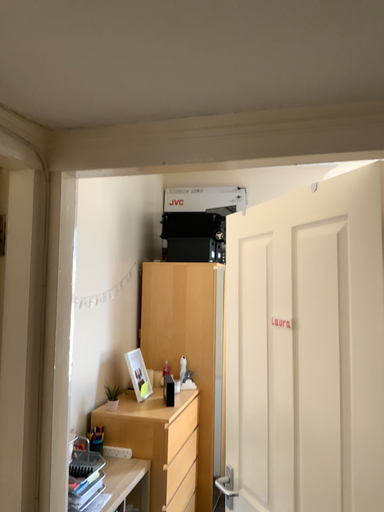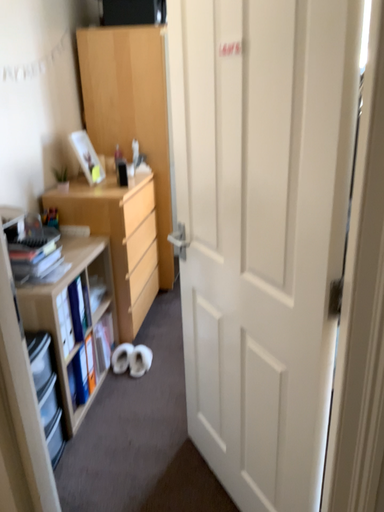
Question: How did the camera likely rotate when shooting the video?

Choices:
 (A) rotated downward
 (B) rotated upward

Answer: (A)